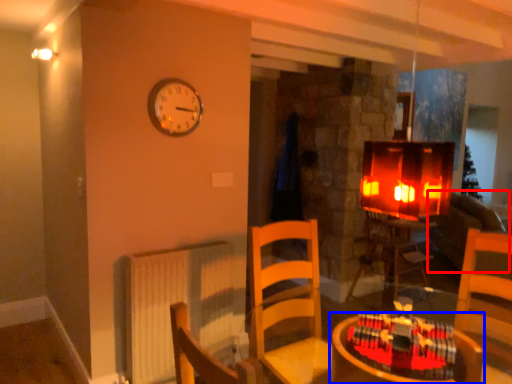
Question: Among these objects, which one is farthest to the camera, couch (highlighted by a red box) or table (highlighted by a blue box)?

Choices:
 (A) couch
 (B) table

Answer: (A)